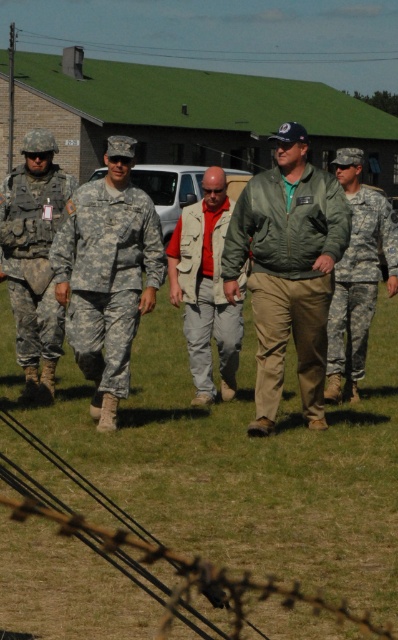
Question: Is camouflage fabric uniform at center below camouflage fabric pants at right?

Choices:
 (A) yes
 (B) no

Answer: (A)

Question: Among these objects, which one is farthest from the camera?

Choices:
 (A) camouflage uniform at center
 (B) brushed metal wire at upper center

Answer: (B)

Question: Does camouflage fabric uniform at center appear on the right side of camouflage fabric uniform at left?

Choices:
 (A) no
 (B) yes

Answer: (B)

Question: Which of these objects is positioned closest to the camouflage fabric pants at right?

Choices:
 (A) brushed metal wire at upper center
 (B) camouflage fabric uniform at center
 (C) camouflage fabric uniform at left

Answer: (B)

Question: Is green matte jacket at center to the right of brushed metal wire at upper center from the viewer's perspective?

Choices:
 (A) yes
 (B) no

Answer: (A)

Question: Which object is the closest to the camouflage fabric uniform at left?

Choices:
 (A) camouflage fabric pants at right
 (B) camouflage fabric uniform at center
 (C) khaki fabric vest at center
 (D) camouflage uniform at center

Answer: (B)